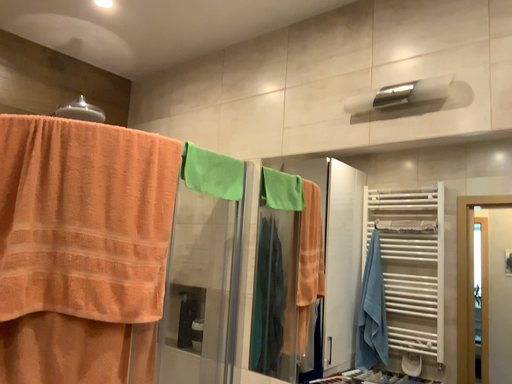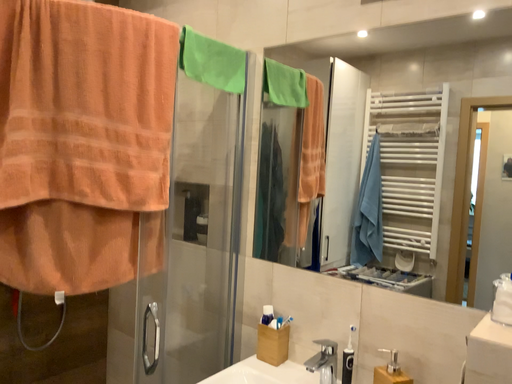
Question: How did the camera likely rotate when shooting the video?

Choices:
 (A) rotated upward
 (B) rotated downward

Answer: (B)